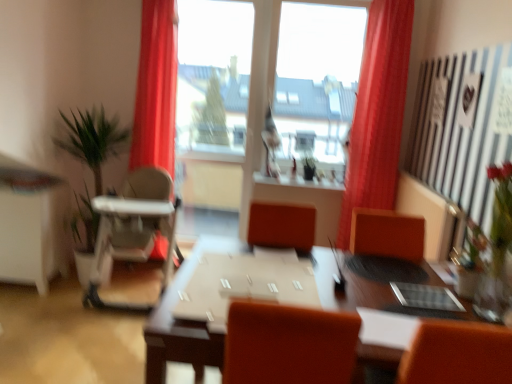
You are a GUI agent. You are given a task and a screenshot of the screen. Output one action in this format:
    pyautogui.click(x=<x>, y=<y>)
    Task: Click on the matte red curtain at center
    
    Given the screenshot: What is the action you would take?
    pyautogui.click(x=378, y=112)

Locate an element on the screen. The image size is (512, 384). clear glass vase at right is located at coordinates (492, 289).

The height and width of the screenshot is (384, 512). In order to click on armchair above the clear glass vase at right (from the image's perspective) in this screenshot , I will do `click(133, 228)`.

Is white plastic high chair at left spatially inside clear glass vase at right, or outside of it?

white plastic high chair at left is located beyond the bounds of clear glass vase at right.

From a real-world perspective, who is located lower, white plastic high chair at left or clear glass vase at right?

In real-world perspective, white plastic high chair at left is lower.

Are white plastic high chair at left and clear glass vase at right beside each other?

No, white plastic high chair at left is not with clear glass vase at right.

Is point (132, 177) closer or farther from the camera than point (205, 37)?

Point (132, 177) is positioned closer to the camera compared to point (205, 37).

From the image's perspective, would you say white plastic high chair at left is positioned over transparent glass window at center?

Actually, white plastic high chair at left appears below transparent glass window at center in the image.

Is transparent glass window at center inside white plastic high chair at left?

Definitely not — transparent glass window at center is not inside white plastic high chair at left.

Is transparent glass window at center outside of white plastic high chair at left?

transparent glass window at center is positioned outside white plastic high chair at left.

Which is closer to the camera, (210,142) or (119,246)?

The point (119,246) is closer to the camera.

From a real-world perspective, relative to white plastic high chair at left, is transparent glass window at center vertically above or below?

Clearly, from a real-world perspective, transparent glass window at center is above white plastic high chair at left.

In the image, is transparent glass window at center positioned in front of or behind white plastic high chair at left?

Clearly, transparent glass window at center is behind white plastic high chair at left.

From the picture: In the image, is matte red curtain at center on the left side or the right side of white glossy computer desk at left?

In the image, matte red curtain at center appears on the right side of white glossy computer desk at left.

Considering the sizes of objects matte red curtain at center and white glossy computer desk at left in the image provided, who is smaller, matte red curtain at center or white glossy computer desk at left?

Smaller between the two is matte red curtain at center.

Considering the positions of points (362, 84) and (8, 222), is point (362, 84) closer to camera compared to point (8, 222)?

No, (362, 84) is behind (8, 222).

Is transparent glass window at center turned away from white plastic high chair at left?

No.

Is transparent glass window at center thinner than white plastic high chair at left?

Correct, the width of transparent glass window at center is less than that of white plastic high chair at left.

Does transparent glass window at center have a lesser height compared to white plastic high chair at left?

In fact, transparent glass window at center may be taller than white plastic high chair at left.

Locate an element on the screen. glass vase located on the right of green leafy plant at left is located at coordinates (492, 289).

From the image's perspective, would you say clear glass vase at right is shown under green leafy plant at left?

Yes, from the image's perspective, clear glass vase at right is below green leafy plant at left.

In the scene shown: Which of these two, clear glass vase at right or green leafy plant at left, is bigger?

green leafy plant at left is bigger.

Is white glossy computer desk at left looking in the opposite direction of transparent glass window at center?

No, white glossy computer desk at left is not facing the opposite direction of transparent glass window at center.

Can you confirm if white glossy computer desk at left is positioned to the right of transparent glass window at center?

No.

Between white glossy computer desk at left and transparent glass window at center, which one has smaller size?

With smaller size is white glossy computer desk at left.

Is white glossy computer desk at left spatially inside transparent glass window at center, or outside of it?

white glossy computer desk at left is located beyond the bounds of transparent glass window at center.

Where is `glass vase below the white plastic high chair at left (from the image's perspective)`? glass vase below the white plastic high chair at left (from the image's perspective) is located at coordinates 492,289.

This screenshot has height=384, width=512. Find the location of `window screen above the white plastic high chair at left (from the image's perspective)`. window screen above the white plastic high chair at left (from the image's perspective) is located at coordinates (213, 76).

Which object lies further to the anchor point green leafy plant at left, clear glass vase at right or white glossy computer desk at left?

clear glass vase at right is positioned further to the anchor green leafy plant at left.

Looking at the image, which one is located closer to brown wooden table at center, white plastic high chair at left or clear glass vase at right?

clear glass vase at right lies closer to brown wooden table at center than the other object.

Which object lies further to the anchor point clear glass vase at right, matte red curtain at center or brown wooden table at center?

A: matte red curtain at center is further to clear glass vase at right.

Based on their spatial positions, is white plastic high chair at left or green leafy plant at left closer to white glossy computer desk at left?

green leafy plant at left is positioned closer to the anchor white glossy computer desk at left.

When comparing their distances from green leafy plant at left, does matte red curtain at center or transparent glass window at center seem further?

matte red curtain at center is further to green leafy plant at left.

Looking at this image, estimate the real-world distances between objects in this image. Which object is further from brown wooden table at center, transparent glass window at center or white plastic high chair at left?

transparent glass window at center is positioned further to the anchor brown wooden table at center.

Based on their spatial positions, is white plastic high chair at left or green leafy plant at left closer to matte red curtain at center?

white plastic high chair at left is closer to matte red curtain at center.

Considering their positions, is transparent glass window at center positioned further to white glossy computer desk at left than clear glass vase at right?

Among the two, clear glass vase at right is located further to white glossy computer desk at left.

The width and height of the screenshot is (512, 384). In order to click on armchair situated between green leafy plant at left and clear glass vase at right from left to right in this screenshot , I will do `click(133, 228)`.

This screenshot has width=512, height=384. I want to click on curtain between white plastic high chair at left and clear glass vase at right in the horizontal direction, so point(378,112).

Identify the location of window screen between green leafy plant at left and clear glass vase at right from left to right. (213, 76).

Where is `curtain between clear glass vase at right and transparent glass window at center from front to back`? The width and height of the screenshot is (512, 384). curtain between clear glass vase at right and transparent glass window at center from front to back is located at coordinates (378, 112).